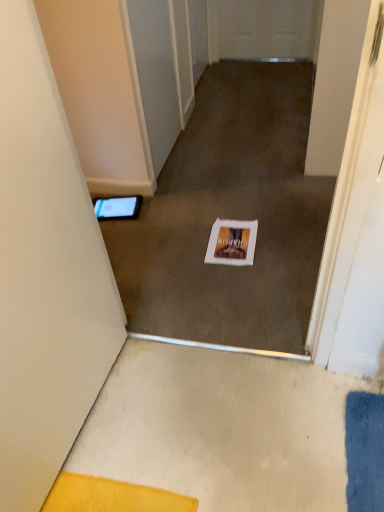
Question: Considering the positions of white matte door at left and white paper at center in the image, is white matte door at left wider or thinner than white paper at center?

Choices:
 (A) thin
 (B) wide

Answer: (A)

Question: Relative to white paper at center, is white matte door at left in front or behind?

Choices:
 (A) front
 (B) behind

Answer: (A)

Question: Which of these objects is positioned farthest from the black glossy tablet at left?

Choices:
 (A) white matte door at left
 (B) white paper at center

Answer: (A)

Question: Estimate the real-world distances between objects in this image. Which object is farther from the black glossy tablet at left?

Choices:
 (A) white matte door at left
 (B) white paper at center

Answer: (A)